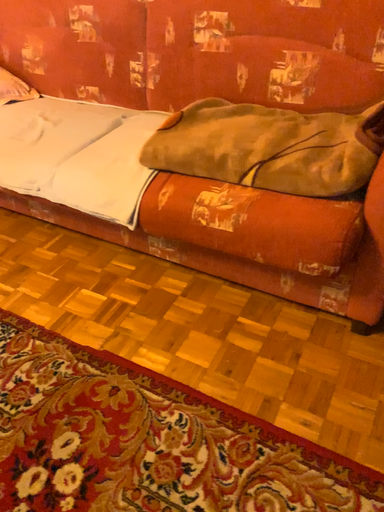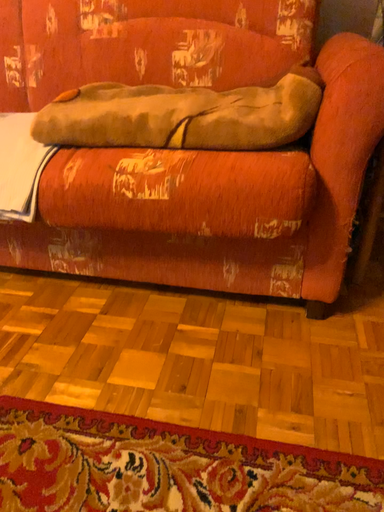
Question: How did the camera likely rotate when shooting the video?

Choices:
 (A) rotated right
 (B) rotated left

Answer: (A)